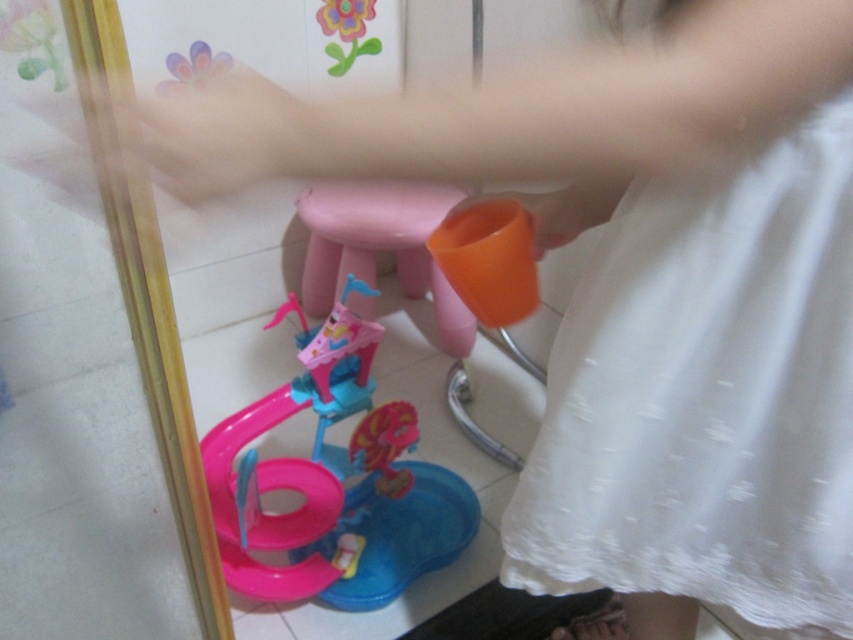
Where is the white lace dress at lower right located in the image?

The white lace dress at lower right is located at point (706,396) in the image.

You are a photographer trying to capture a clear shot of the white lace dress at lower right and the pink plastic toy at lower center. Since the dress is moving, you want to adjust your focus. Which object should you focus on to ensure it stays sharp in the photo?

The white lace dress at lower right is positioned on the right side of the pink plastic toy at lower center. Since the dress is moving, focusing on the pink plastic toy at lower center would be better because it is stationary and less likely to blur.

You are a parent trying to tidy up the room. You see the pink plastic toy at lower center and the pink plastic stool at center. Which item should you pick up first if you want to reach the one closer to you first?

You should pick up the pink plastic toy at lower center first because it is closer to you than the pink plastic stool at center.